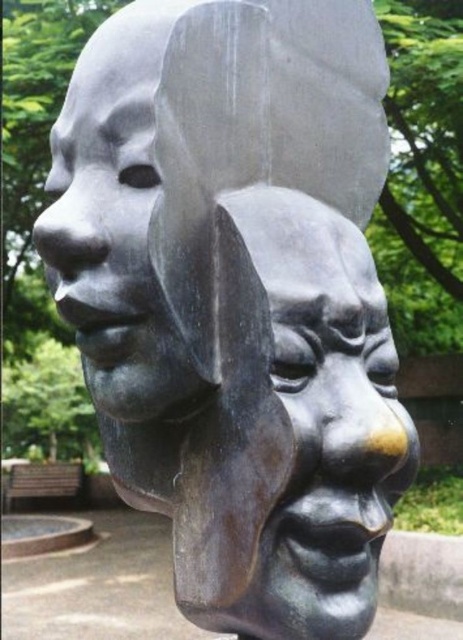
Does shiny bronze mask at center have a larger size compared to matte bronze face at upper left?

Correct, shiny bronze mask at center is larger in size than matte bronze face at upper left.

From the picture: Does shiny bronze mask at center appear on the left side of matte bronze face at upper left?

No, shiny bronze mask at center is not to the left of matte bronze face at upper left.

Identify the location of shiny bronze mask at center. (323, 419).

Where is `shiny bronze mask at center`? Image resolution: width=463 pixels, height=640 pixels. shiny bronze mask at center is located at coordinates (323, 419).